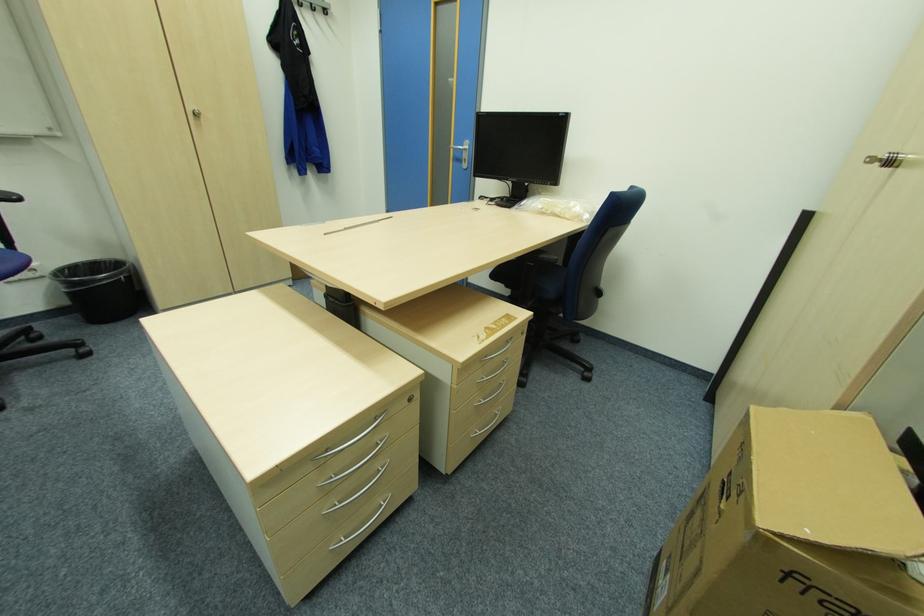
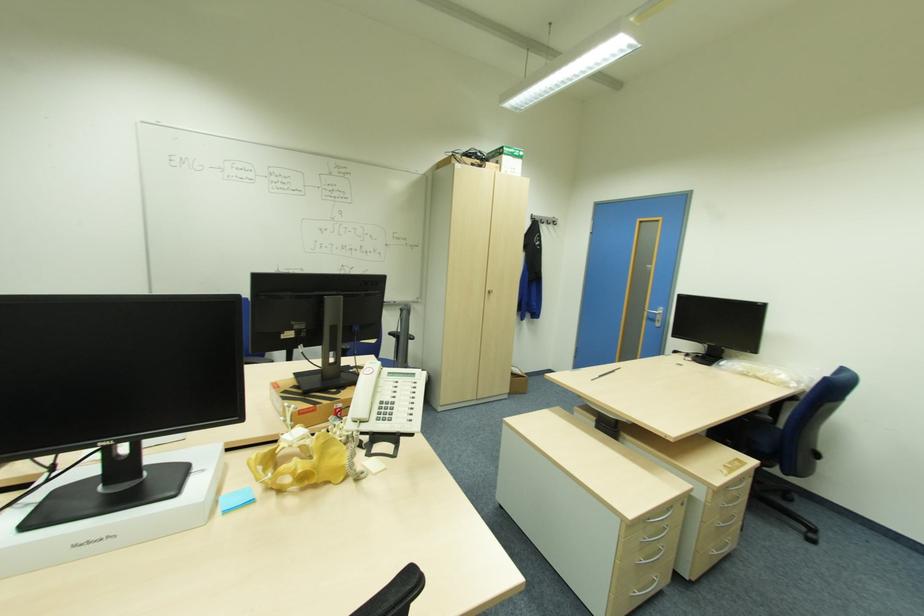
Based on the photo, the images are taken continuously from a first-person perspective. In which direction are you moving?

The cameraman moved toward left, backward.